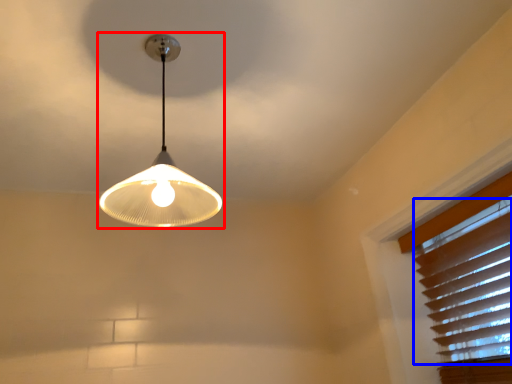
Question: Among these objects, which one is farthest to the camera, lamp (highlighted by a red box) or blind (highlighted by a blue box)?

Choices:
 (A) lamp
 (B) blind

Answer: (B)